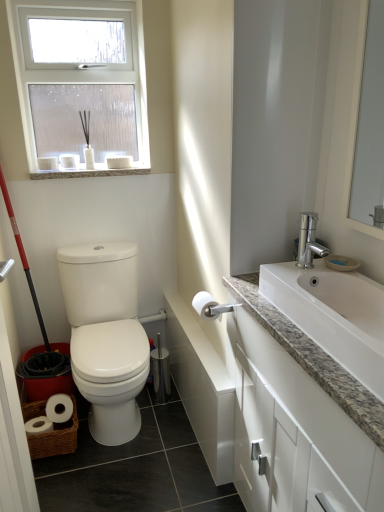
You are a GUI agent. You are given a task and a screenshot of the screen. Output one action in this format:
    pyautogui.click(x=<x>, y=<y>)
    Task: Click on the free space on the front side of white glossy toilet at left
    The width and height of the screenshot is (384, 512).
    Given the screenshot: What is the action you would take?
    pyautogui.click(x=116, y=456)